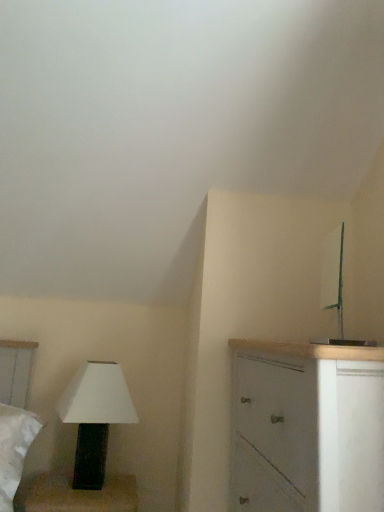
Question: Can you confirm if white matte cabinet at right is positioned to the right of white matte lamp at lower left?

Choices:
 (A) no
 (B) yes

Answer: (B)

Question: Could you tell me if white matte cabinet at right is facing white matte lamp at lower left?

Choices:
 (A) yes
 (B) no

Answer: (B)

Question: Is white matte cabinet at right located outside white matte lamp at lower left?

Choices:
 (A) yes
 (B) no

Answer: (A)

Question: Is white matte cabinet at right wider than white matte lamp at lower left?

Choices:
 (A) no
 (B) yes

Answer: (B)

Question: Is white matte cabinet at right oriented away from white matte lamp at lower left?

Choices:
 (A) no
 (B) yes

Answer: (A)

Question: Is the position of white matte cabinet at right more distant than that of white matte lamp at lower left?

Choices:
 (A) yes
 (B) no

Answer: (B)

Question: From a real-world perspective, is white matte lamp at lower left over white matte cabinet at right?

Choices:
 (A) yes
 (B) no

Answer: (B)

Question: Is white matte lamp at lower left looking in the opposite direction of white matte cabinet at right?

Choices:
 (A) no
 (B) yes

Answer: (A)

Question: Is white matte lamp at lower left wider than white matte cabinet at right?

Choices:
 (A) yes
 (B) no

Answer: (B)

Question: Is white matte lamp at lower left closer to camera compared to white matte cabinet at right?

Choices:
 (A) no
 (B) yes

Answer: (A)

Question: Is white matte lamp at lower left next to white matte cabinet at right and touching it?

Choices:
 (A) no
 (B) yes

Answer: (A)

Question: Is white matte lamp at lower left not near white matte cabinet at right?

Choices:
 (A) yes
 (B) no

Answer: (B)

Question: Does point (344, 499) appear closer or farther from the camera than point (102, 434)?

Choices:
 (A) closer
 (B) farther

Answer: (A)